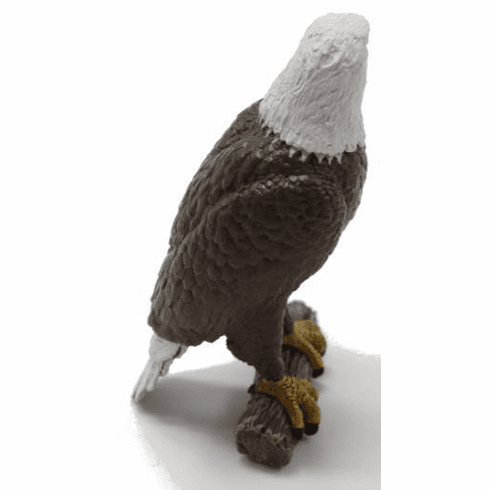
The width and height of the screenshot is (490, 490). I want to click on table, so click(x=194, y=443).